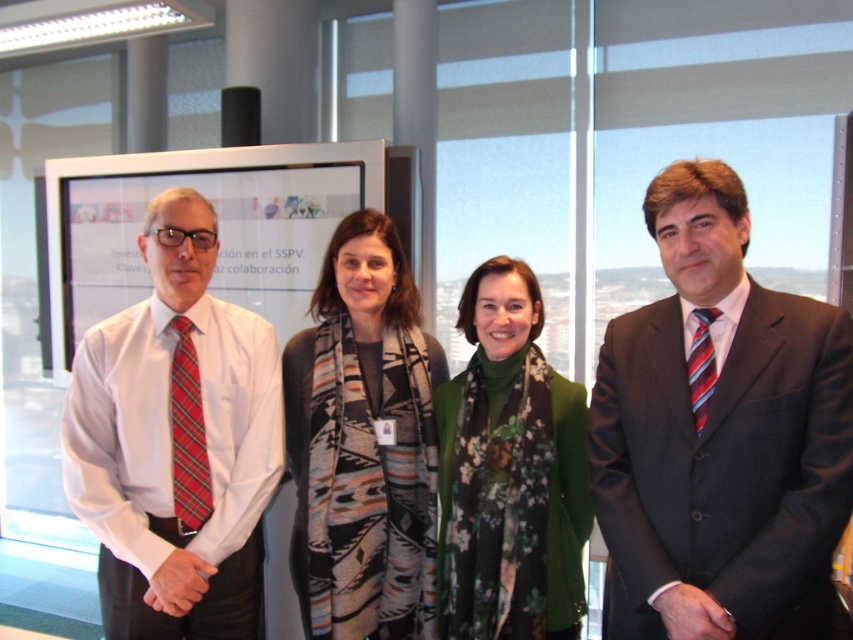
Which is behind, point (309, 483) or point (212, 284)?

The point (212, 284) is more distant.

Is printed scarf at center bigger than matte white poster at center?

Actually, printed scarf at center might be smaller than matte white poster at center.

Who is more distant from viewer, (376, 344) or (306, 202)?

Positioned behind is point (306, 202).

Identify the location of printed scarf at center. The width and height of the screenshot is (853, 640). (358, 422).

Is point (682, 602) farther from viewer compared to point (485, 531)?

No, it is in front of (485, 531).

Identify the location of dark gray suit at center. Image resolution: width=853 pixels, height=640 pixels. (718, 435).

Who is shorter, dark gray suit at center or matte white poster at center?

With less height is matte white poster at center.

Is dark gray suit at center positioned before matte white poster at center?

Yes, dark gray suit at center is in front of matte white poster at center.

Between point (674, 532) and point (209, 186), which one is positioned behind?

Positioned behind is point (209, 186).

Find the location of a particular element. dark gray suit at center is located at coordinates (718, 435).